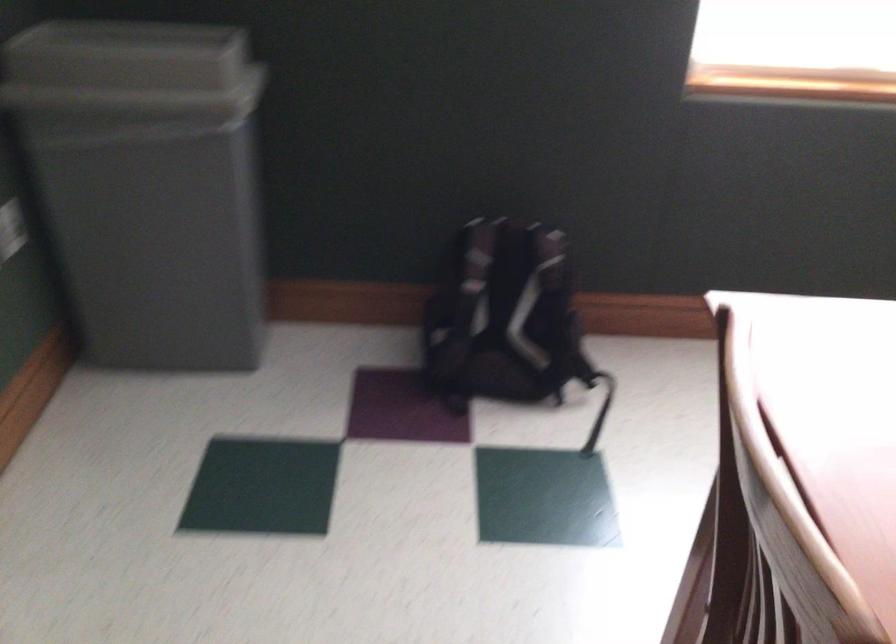
This screenshot has width=896, height=644. What do you see at coordinates (131, 71) in the screenshot?
I see `the translucent trash can lid` at bounding box center [131, 71].